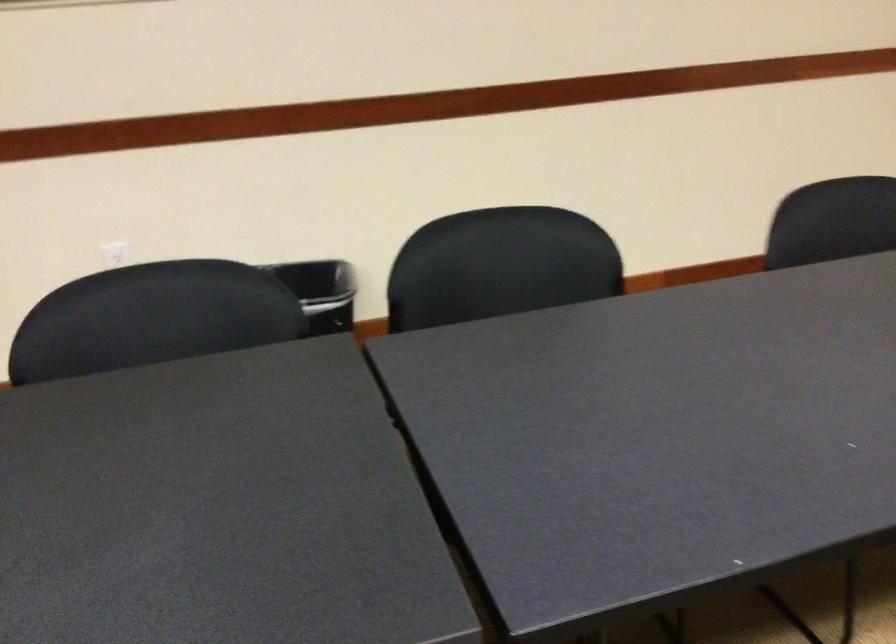
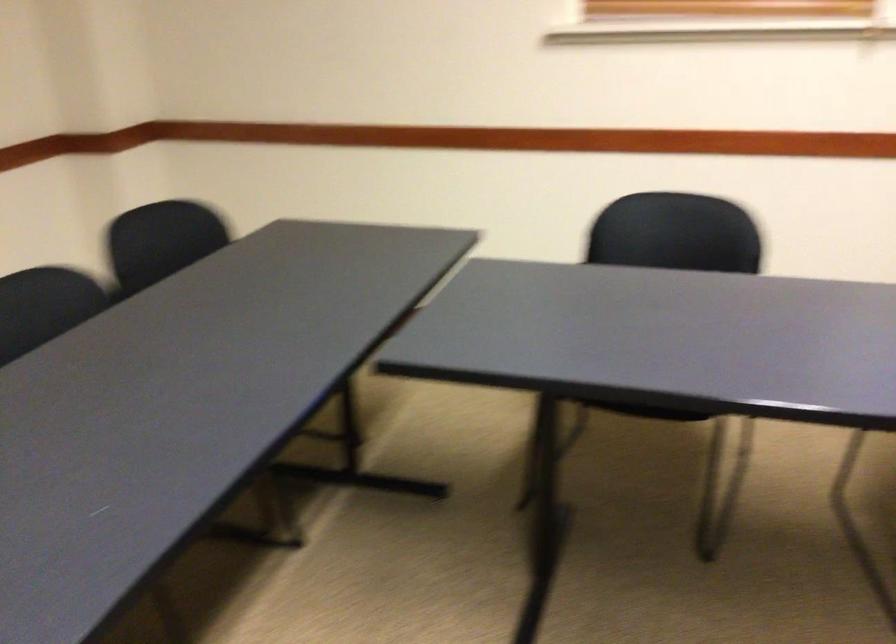
Question: The images are taken continuously from a first-person perspective. In which direction is your viewpoint rotating?

Choices:
 (A) Left
 (B) Right
 (C) Up
 (D) Down

Answer: (B)